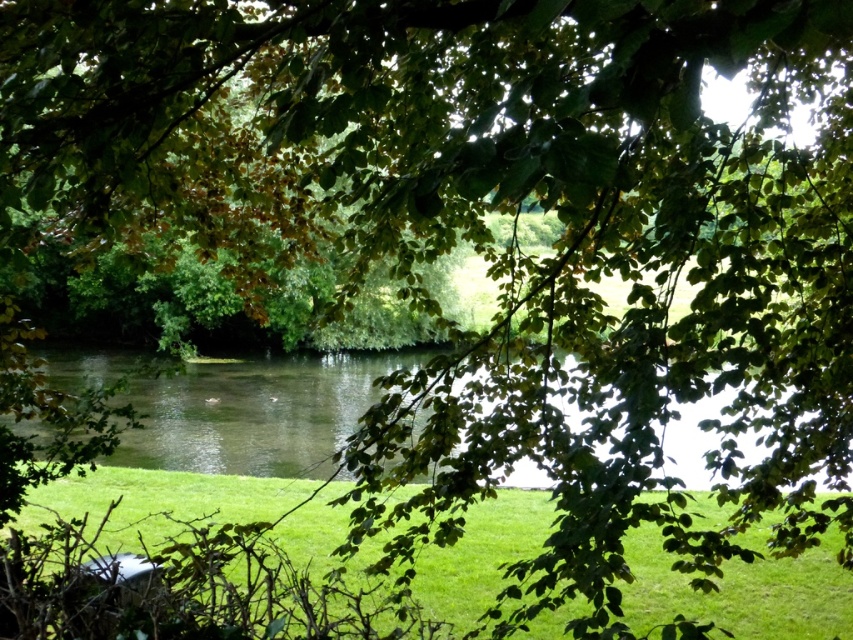
You are standing at the edge of the water in the image and want to walk to the point marked as point (743, 592). Based on the scene description, what type of terrain will you encounter when you reach that point?

The point (743, 592) is on green grassy at lower center, so you will encounter green grassy terrain there.

You are a gardener who wants to plant flowers in the green grassy at lower center and clear water at center. Which area requires more soil to be added to raise its level to match the other?

The green grassy at lower center requires more soil because it is shorter than the clear water at center, so to match the level of the clear water at center, you need to add soil to the green grassy at lower center until it reaches the same height.